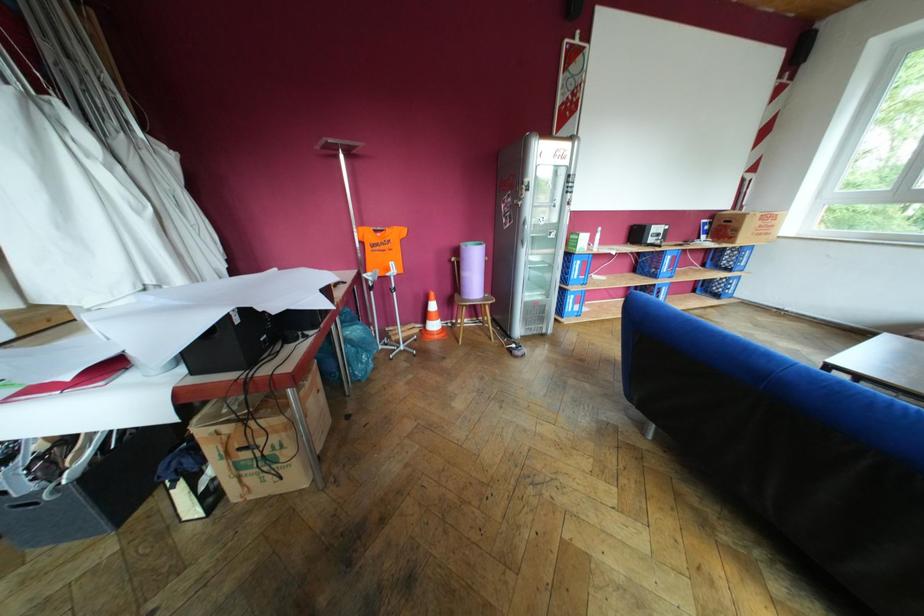
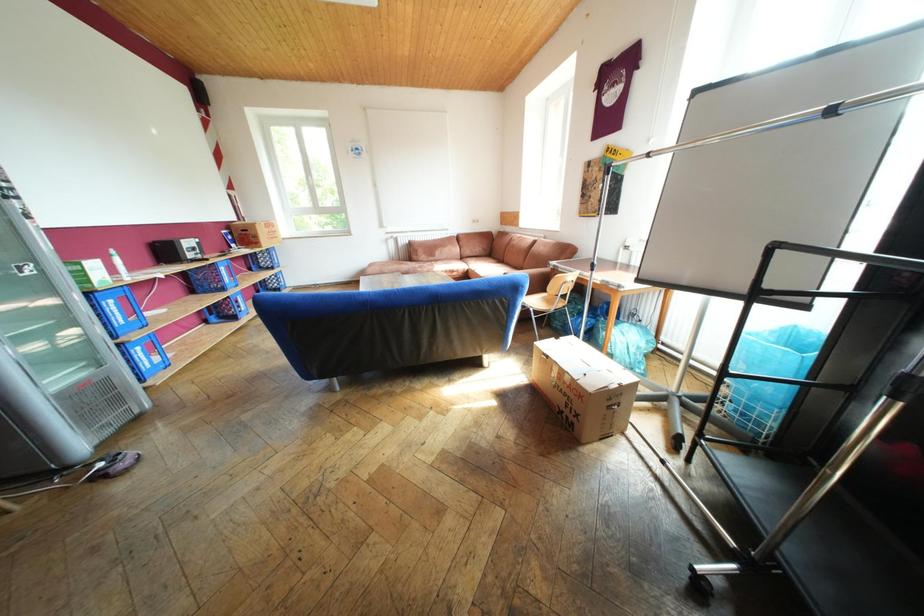
The first image is from the beginning of the video and the second image is from the end. How did the camera likely rotate when shooting the video?

The rotation direction of the camera is right-down.